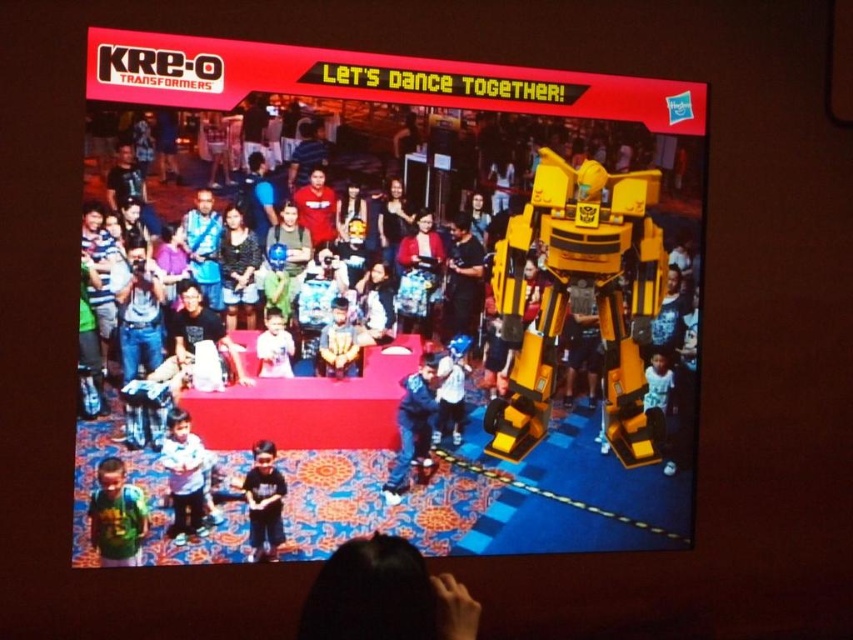
You are a photographer standing at the center of the scene. You want to take a photo of the green jersey at lower left. Which direction should you move to get a better shot?

You should move to your left to get a better shot of the green jersey at lower left since it is located at point (x=115, y=516), which is towards the lower left of the frame.

Based on the photo, you are a photographer at the event and want to capture a photo where both the green jersey at lower left and the blue fabric cap at center are visible. Considering their heights, which object should you focus on to ensure both are in frame?

The green jersey at lower left has a lesser height compared to the blue fabric cap at center. To ensure both are visible, focus on the blue fabric cap at center since it is taller, allowing the shorter green jersey at lower left to also be in frame.

What object is located at the coordinates point (339, 342) in the image?

The point (339, 342) corresponds to the smooth skin face at center.